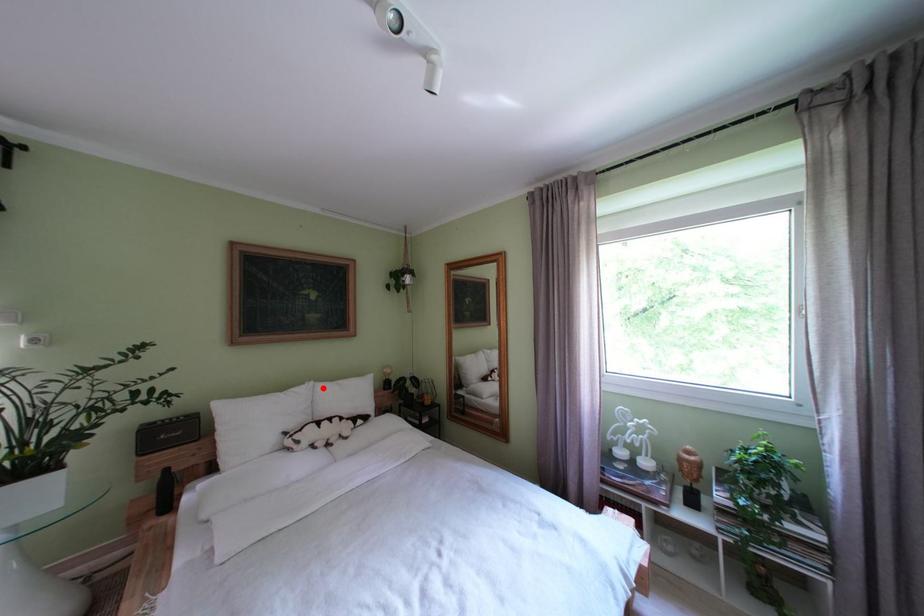
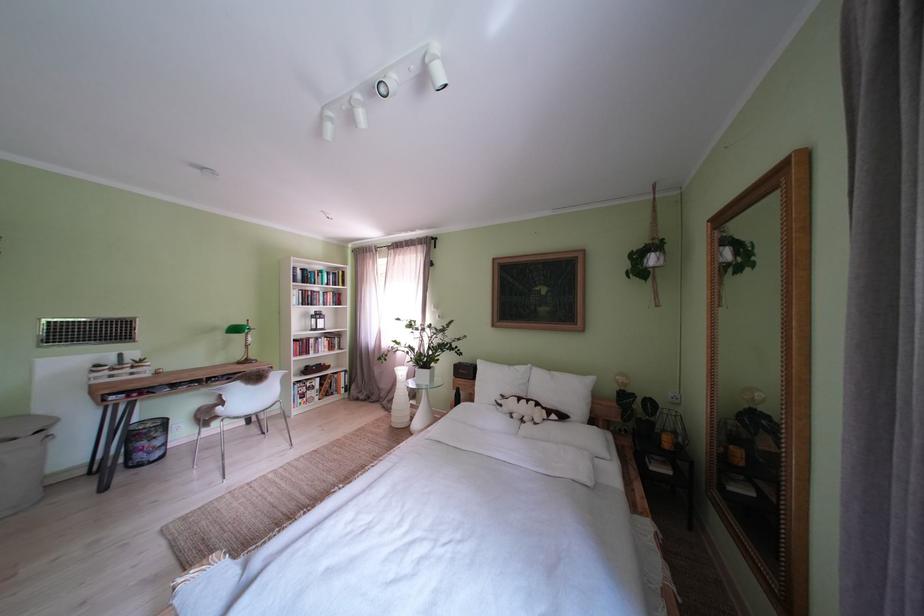
The point at the highlighted location is marked in the first image. Where is the corresponding point in the second image?

(541, 371)